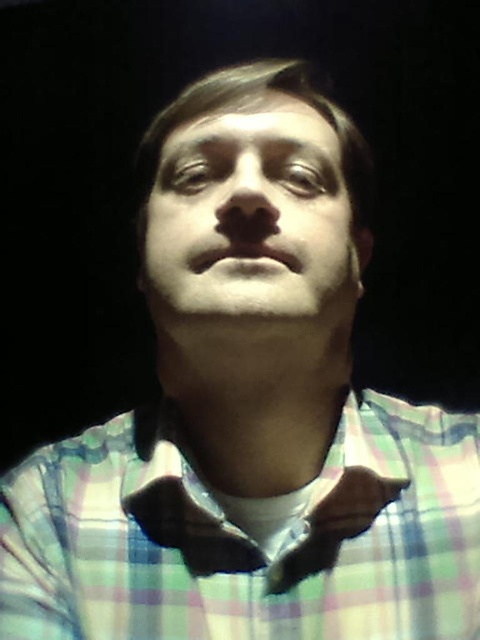
Can you confirm if checkered fabric shirt at center is positioned below brown leather bow tie at center?

No.

Who is more forward, (207, 625) or (402, 488)?

Positioned in front is point (207, 625).

Identify the location of checkered fabric shirt at center. The image size is (480, 640). (243, 538).

Locate an element on the screen. The height and width of the screenshot is (640, 480). checkered fabric shirt at center is located at coordinates (243, 538).